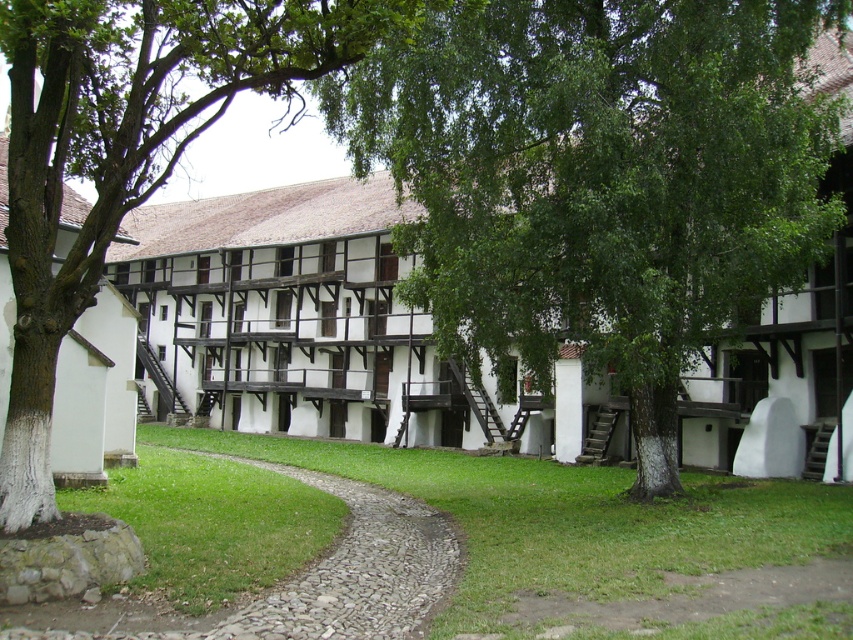
Question: Which of the following is the farthest from the observer?

Choices:
 (A) green leafy tree at center
 (B) green grass at center
 (C) green leafy tree at left

Answer: (A)

Question: Does green leafy tree at left lie in front of green grass at center?

Choices:
 (A) no
 (B) yes

Answer: (A)

Question: Can you confirm if green leafy tree at left is positioned below green grass at center?

Choices:
 (A) no
 (B) yes

Answer: (A)

Question: Is the position of green leafy tree at left more distant than that of green grass at center?

Choices:
 (A) no
 (B) yes

Answer: (B)

Question: Which of the following is the farthest from the observer?

Choices:
 (A) (375, 515)
 (B) (704, 502)
 (C) (569, 138)

Answer: (A)

Question: Estimate the real-world distances between objects in this image. Which object is closer to the green leafy tree at left?

Choices:
 (A) green leafy tree at center
 (B) green grass at center
 (C) gray gravel path at center

Answer: (A)